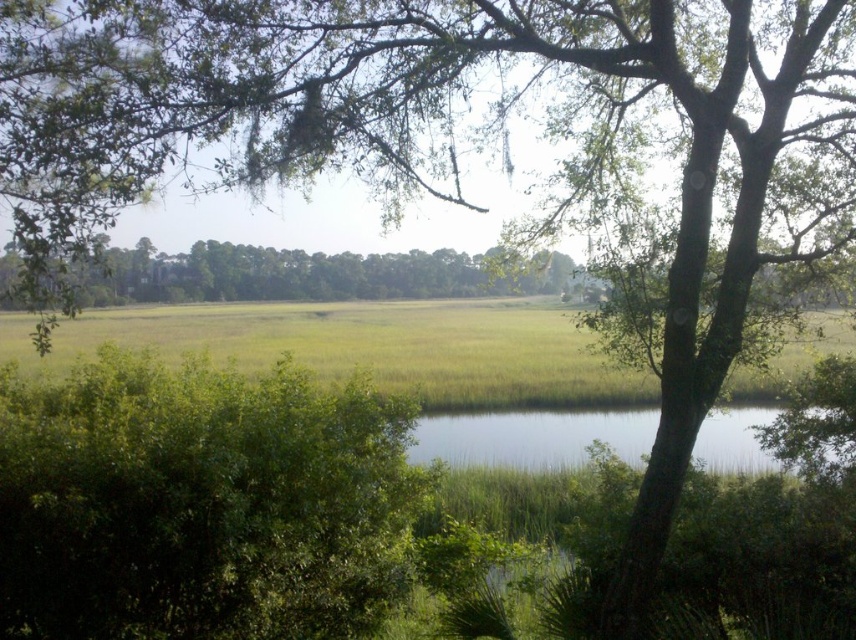
You are standing at the edge of the green grassy field at center and want to reach the clear water at center. Which direction should you walk to get there?

The clear water at center is behind the green grassy field at center, so you should walk forward towards the clear water at center.

You are standing in the middle of the scene and want to walk towards the green leafy bush at center. Which direction should you move relative to the green leafy tree at center?

The green leafy bush at center is to the right of the green leafy tree at center, so you should move to the right relative to the green leafy tree at center to reach the bush.

You are standing in the middle of the green grassy field at center and want to move towards the green leafy bush at center. Which direction should you move to get closer to the bush?

Since the green leafy bush at center has a lesser width compared to the green grassy field at center, you should move towards the direction where the area becomes narrower to reach the green leafy bush at center.